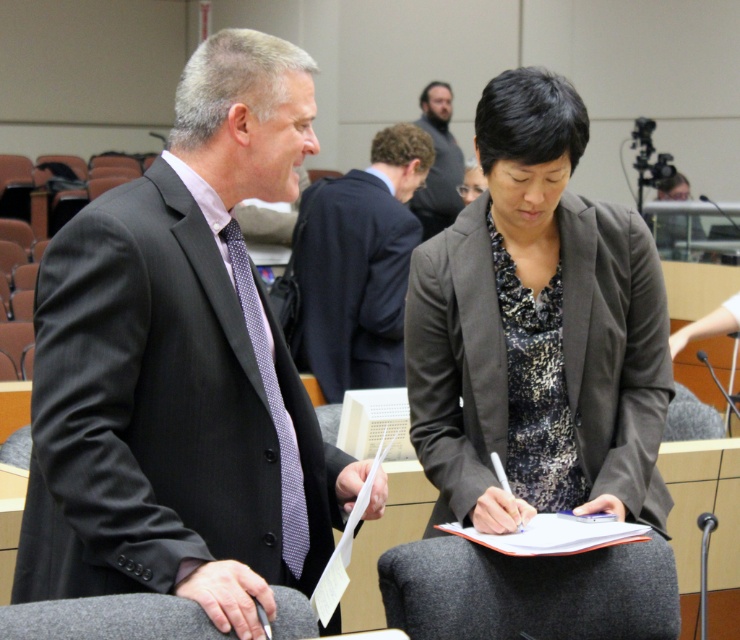
Question: Estimate the real-world distances between objects in this image. Which object is closer to the dark gray textured blazer at center?

Choices:
 (A) matte black suit at left
 (B) matte black suit at center
 (C) dark brown hair at center
 (D) dark suit at center

Answer: (A)

Question: Can you confirm if dark brown hair at center is bigger than matte black suit at center?

Choices:
 (A) yes
 (B) no

Answer: (A)

Question: Is matte black suit at left wider than dark brown hair at center?

Choices:
 (A) yes
 (B) no

Answer: (A)

Question: Does dark gray textured blazer at center appear over dark brown hair at center?

Choices:
 (A) no
 (B) yes

Answer: (A)

Question: Which point is farther from the camera taking this photo?

Choices:
 (A) (457, 193)
 (B) (650, 492)
 (C) (357, 376)

Answer: (A)

Question: Among these points, which one is farthest from the camera?

Choices:
 (A) (474, 420)
 (B) (141, 285)

Answer: (A)